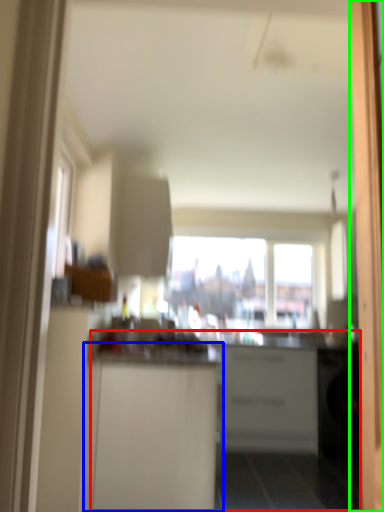
Question: Which is farther away from counter (highlighted by a red box)? cabinetry (highlighted by a blue box) or screen door (highlighted by a green box)?

Choices:
 (A) cabinetry
 (B) screen door

Answer: (B)